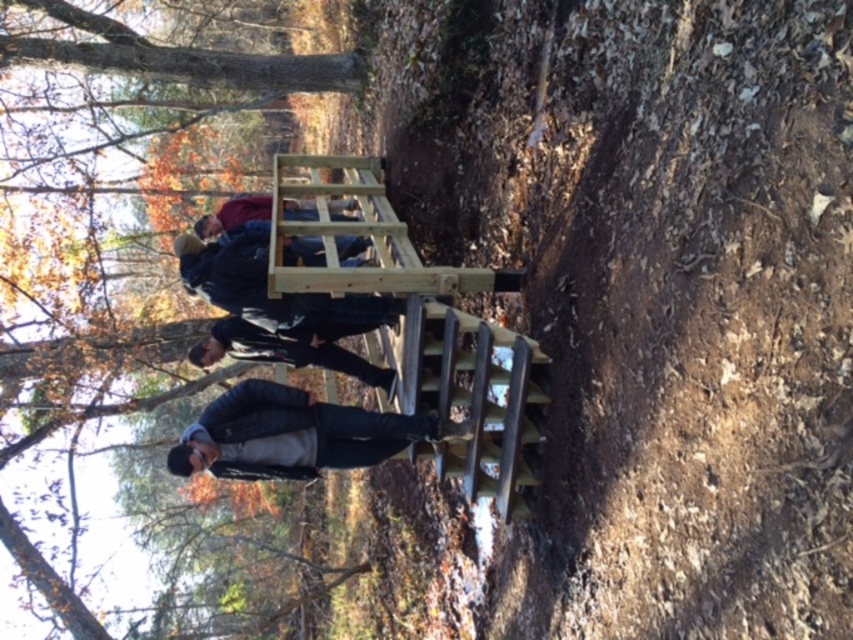
You are a hiker carrying a dark gray leather jacket at center and need to climb the light brown wooden ladder at center. Can you pass through the ladder without dropping the jacket?

The light brown wooden ladder at center is wider than the dark gray leather jacket at center, so yes, you can pass through the ladder without dropping the jacket.

You are a hiker who wants to climb the light brown wooden ladder at center but notices the dark gray leather jacket at center nearby. Is the jacket behind or in front of the ladder?

The light brown wooden ladder at center is in front of the dark gray leather jacket at center, so the jacket is behind the ladder.

You are standing at the bottom of the wooden staircase in the forest. Looking up, you notice a point marked at coordinates (114, 234). What object is located at this point?

The point at (114, 234) indicates a brown wood tree at upper center.